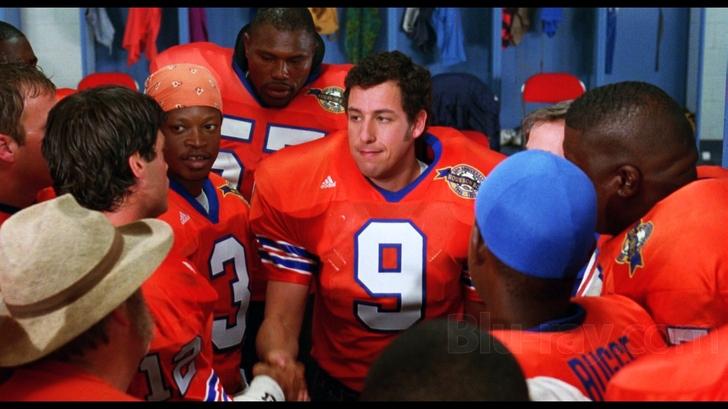
Find the location of a particular element. Image resolution: width=728 pixels, height=409 pixels. wall is located at coordinates (707, 84), (41, 43).